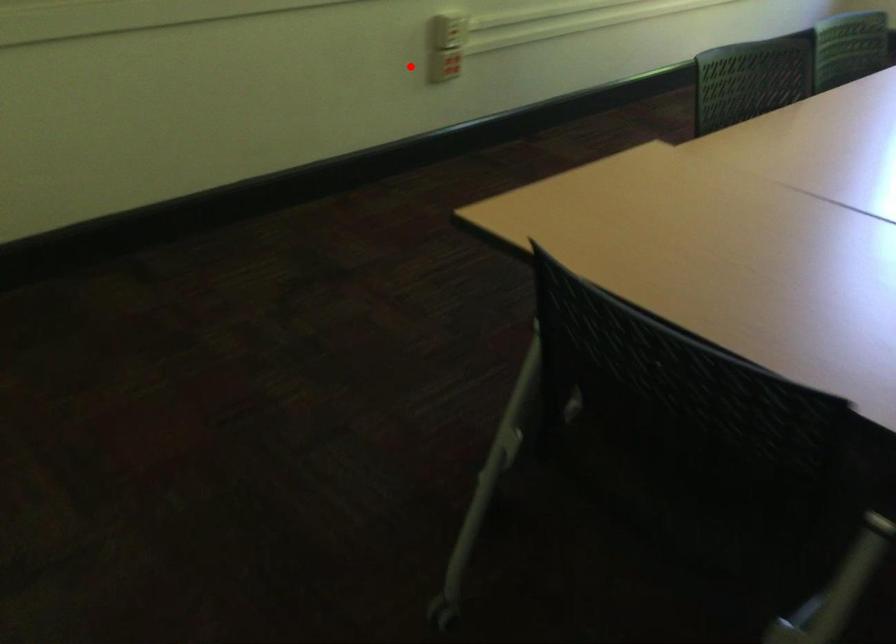
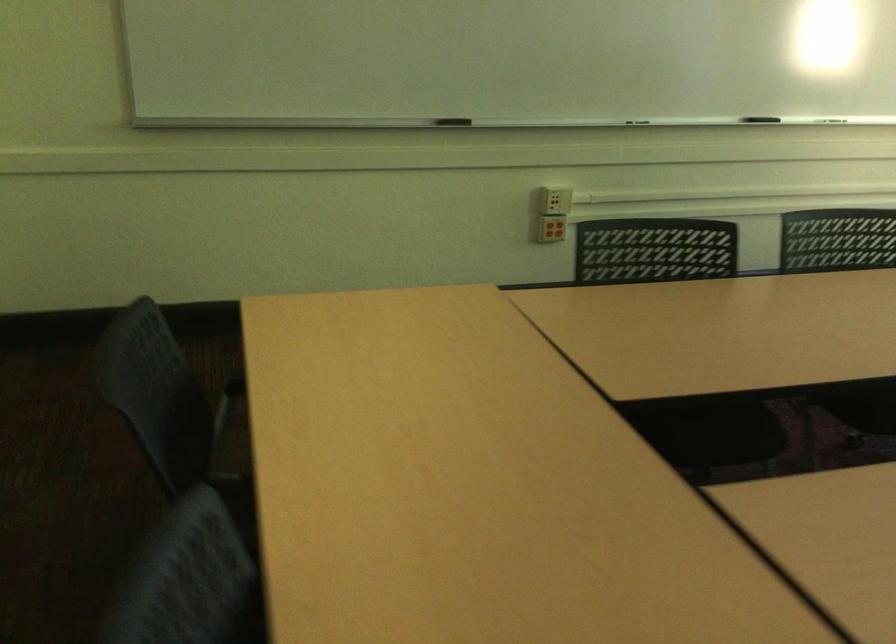
Where in the second image is the point corresponding to the highlighted location from the first image?

(550, 230)